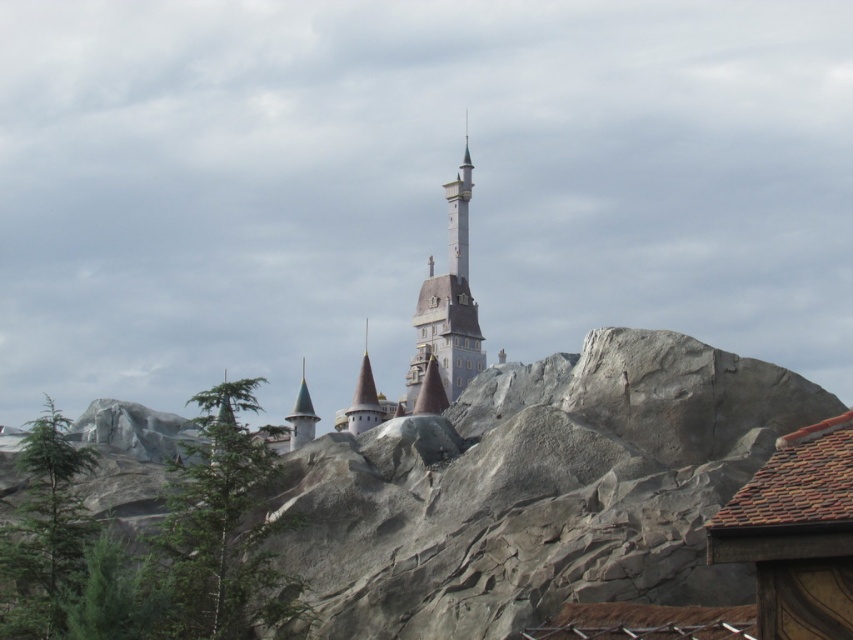
From the picture: You are a visitor standing at the base of the castle, looking up at the white stone tower at center and the gold spire at center. Which of these two structures appears wider from your perspective?

The white stone tower at center appears wider than the gold spire at center because its width is larger than the spire.